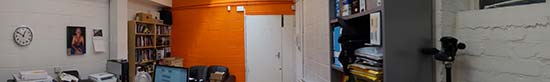
This screenshot has height=82, width=550. Identify the location of calendar. (96, 44).